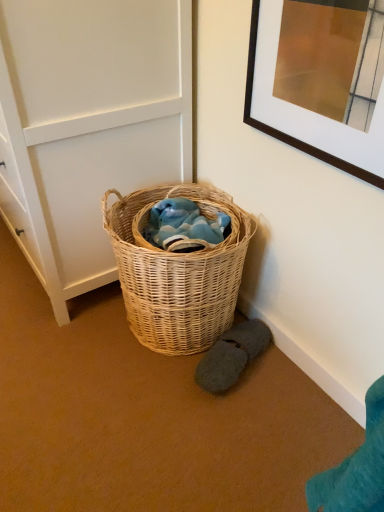
Question: Looking at their shapes, would you say dark gray fuzzy slippers at lower right is wider or thinner than woven natural basket at center?

Choices:
 (A) thin
 (B) wide

Answer: (A)

Question: Does point (210, 391) appear closer or farther from the camera than point (180, 330)?

Choices:
 (A) farther
 (B) closer

Answer: (B)

Question: Which is nearer to the dark gray fuzzy slippers at lower right?

Choices:
 (A) woven natural basket at center
 (B) white paneling at center

Answer: (A)

Question: Estimate the real-world distances between objects in this image. Which object is farther from the dark gray fuzzy slippers at lower right?

Choices:
 (A) woven natural basket at center
 (B) white paneling at center

Answer: (B)